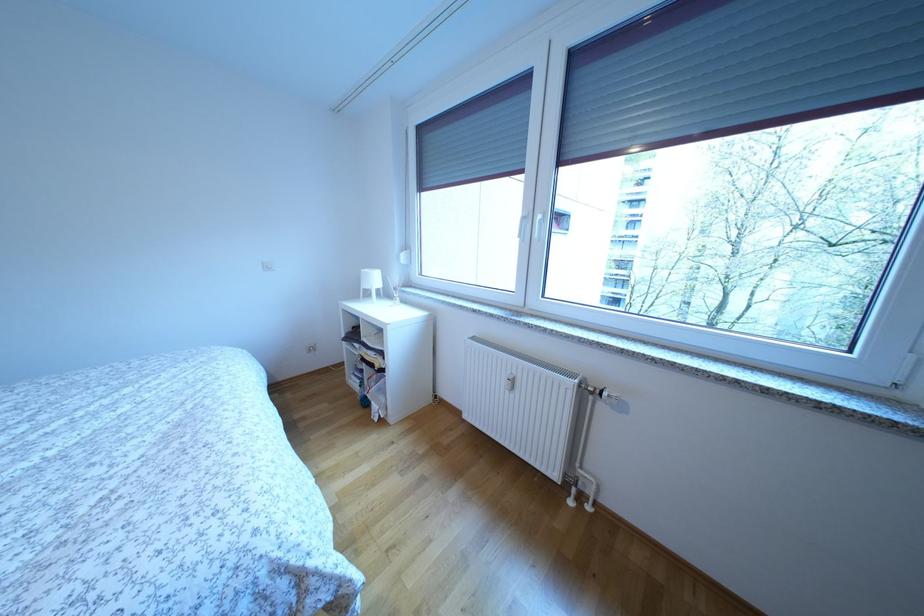
Locate an element on the screen. small white lamp is located at coordinates (370, 282).